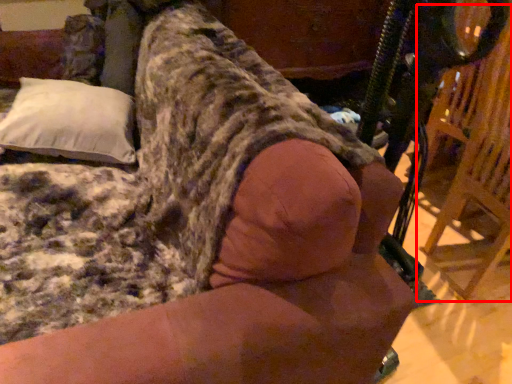
Question: From the image's perspective, where is swivel chair (annotated by the red box) located in relation to pillow in the image?

Choices:
 (A) above
 (B) below

Answer: (B)